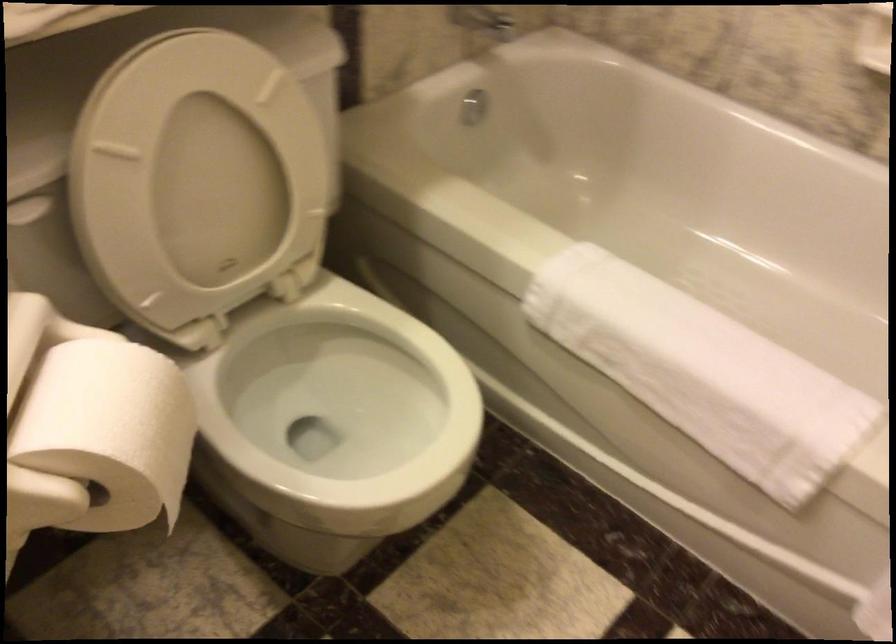
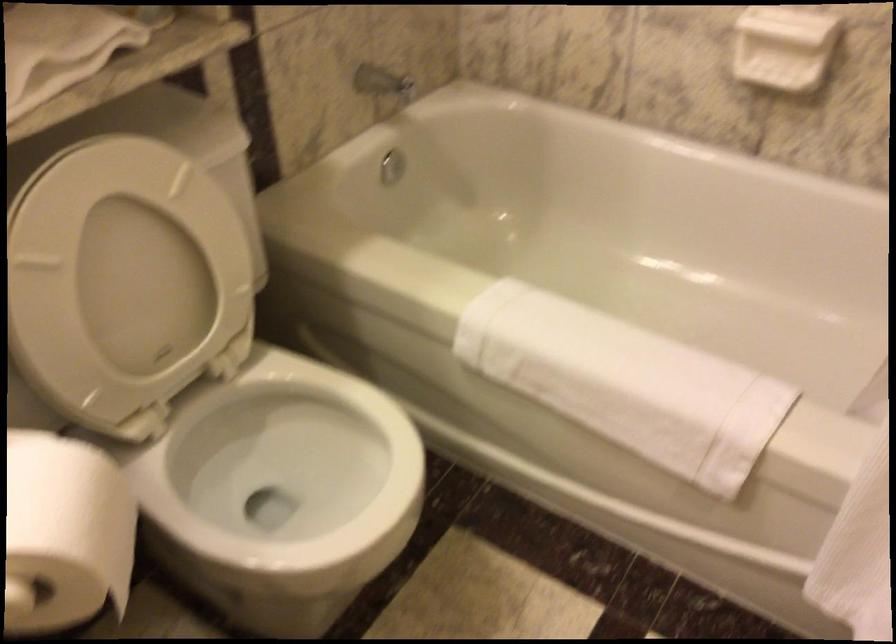
In the second image, find the point that corresponds to pixel 325 397 in the first image.

(281, 464)